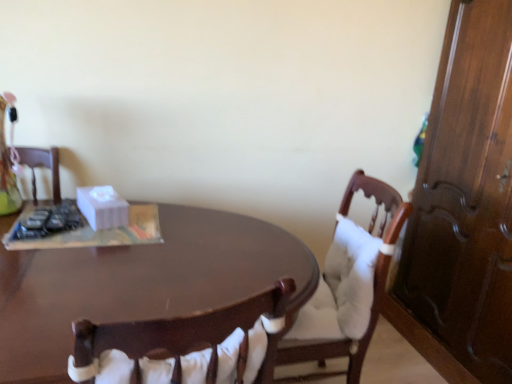
Describe the element at coordinates (138, 283) in the screenshot. The width and height of the screenshot is (512, 384). I see `shiny brown desk at center` at that location.

Find the location of a particular element. This screenshot has height=384, width=512. wooden chair with white cushion at center is located at coordinates (348, 285).

From the image's perspective, which one is positioned lower, shiny brown desk at center or wooden chair with white cushion at center?

shiny brown desk at center is shown below in the image.

Does point (42, 260) come in front of point (356, 350)?

Yes, point (42, 260) is closer to viewer.

Is shiny brown desk at center positioned with its back to wooden chair with white cushion at center?

shiny brown desk at center is not turned away from wooden chair with white cushion at center.

Does shiny brown desk at center touch wooden chair with white cushion at center?

No, shiny brown desk at center is not in contact with wooden chair with white cushion at center.

How different are the orientations of wooden chair with white cushion at center and white matte tissue box at center in degrees?

wooden chair with white cushion at center and white matte tissue box at center are facing 109 degrees away from each other.

Are wooden chair with white cushion at center and white matte tissue box at center beside each other?

There is a gap between wooden chair with white cushion at center and white matte tissue box at center.

Considering the sizes of wooden chair with white cushion at center and white matte tissue box at center in the image, is wooden chair with white cushion at center wider or thinner than white matte tissue box at center?

Considering their sizes, wooden chair with white cushion at center looks broader than white matte tissue box at center.

Is point (300, 309) behind point (111, 207)?

That is False.

From a real-world perspective, is white matte tissue box at center on shiny brown desk at center?

Correct, in the physical world, white matte tissue box at center is higher than shiny brown desk at center.

Considering the relative sizes of white matte tissue box at center and shiny brown desk at center in the image provided, is white matte tissue box at center taller than shiny brown desk at center?

No.

From the image's perspective, does white matte tissue box at center appear lower than shiny brown desk at center?

Actually, white matte tissue box at center appears above shiny brown desk at center in the image.

From the image's perspective, which is below, wooden chair with white cushion at center or shiny brown desk at center?

shiny brown desk at center, from the image's perspective.

Which object is closer to the camera, wooden chair with white cushion at center or shiny brown desk at center?

shiny brown desk at center is in front.

Does wooden chair with white cushion at center have a lesser width compared to shiny brown desk at center?

No.

Which object is positioned more to the right, white matte tissue box at center or wooden chair with white cushion at center?

From the viewer's perspective, wooden chair with white cushion at center appears more on the right side.

Is white matte tissue box at center positioned far away from wooden chair with white cushion at center?

white matte tissue box at center is near wooden chair with white cushion at center, not far away.

Could you tell me if white matte tissue box at center is facing wooden chair with white cushion at center?

No, white matte tissue box at center is not oriented towards wooden chair with white cushion at center.

From a real-world perspective, which object stands above the other?

white matte tissue box at center is physically above.

Which object is closer to the camera taking this photo, shiny brown desk at center or white matte tissue box at center?

shiny brown desk at center is in front.

Which of these two, shiny brown desk at center or white matte tissue box at center, is wider?

Wider between the two is shiny brown desk at center.

You are a GUI agent. You are given a task and a screenshot of the screen. Output one action in this format:
    pyautogui.click(x=<x>, y=<y>)
    Task: Click on the desk located on the left of wooden chair with white cushion at center
    This screenshot has height=384, width=512.
    Given the screenshot: What is the action you would take?
    pyautogui.click(x=138, y=283)

Where is `chair below the white matte tissue box at center (from a real-world perspective)`? This screenshot has height=384, width=512. chair below the white matte tissue box at center (from a real-world perspective) is located at coordinates (348, 285).

Which object lies further to the anchor point wooden chair with white cushion at center, shiny brown desk at center or white matte tissue box at center?

white matte tissue box at center is further to wooden chair with white cushion at center.

Which object lies further to the anchor point shiny brown desk at center, white matte tissue box at center or wooden chair with white cushion at center?

wooden chair with white cushion at center is further to shiny brown desk at center.

Considering their positions, is white matte tissue box at center positioned closer to wooden chair with white cushion at center than shiny brown desk at center?

shiny brown desk at center lies closer to wooden chair with white cushion at center than the other object.

From the image, which object appears to be farther from white matte tissue box at center, shiny brown desk at center or wooden chair with white cushion at center?

wooden chair with white cushion at center lies further to white matte tissue box at center than the other object.

Looking at the image, which one is located closer to shiny brown desk at center, wooden chair with white cushion at center or white matte tissue box at center?

white matte tissue box at center lies closer to shiny brown desk at center than the other object.

Which object lies further to the anchor point white matte tissue box at center, wooden chair with white cushion at center or shiny brown desk at center?

wooden chair with white cushion at center is further to white matte tissue box at center.

At what (x,y) coordinates should I click in order to perform the action: click on chair positioned between shiny brown desk at center and white matte tissue box at center from near to far. Please return your answer as a coordinate pair (x, y). Looking at the image, I should click on (348, 285).